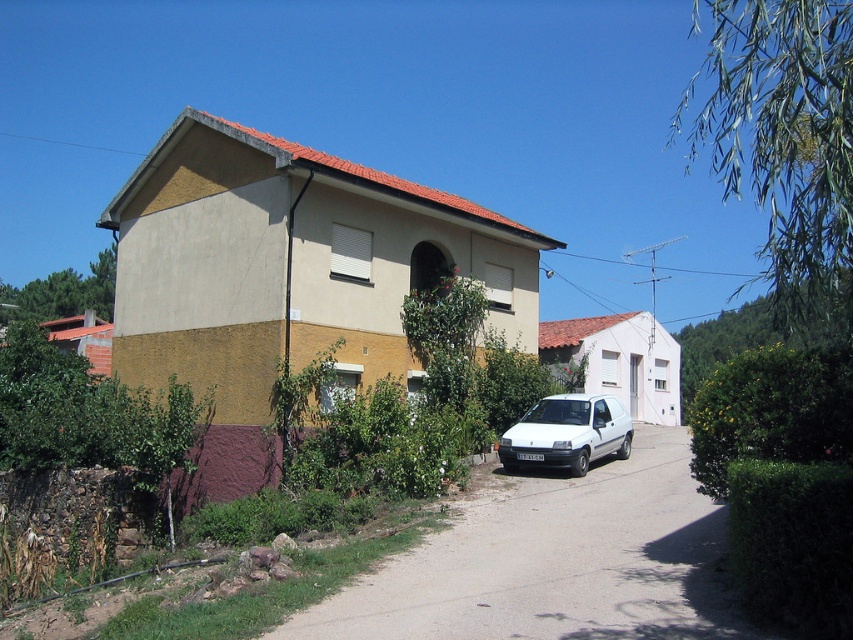
Between point (380, 572) and point (585, 394), which one is positioned in front?

Point (380, 572) is in front.

Is gray concrete driveway at center wider than white matte van at center?

Correct, the width of gray concrete driveway at center exceeds that of white matte van at center.

Find the location of a particular element. This screenshot has width=853, height=640. gray concrete driveway at center is located at coordinates (555, 561).